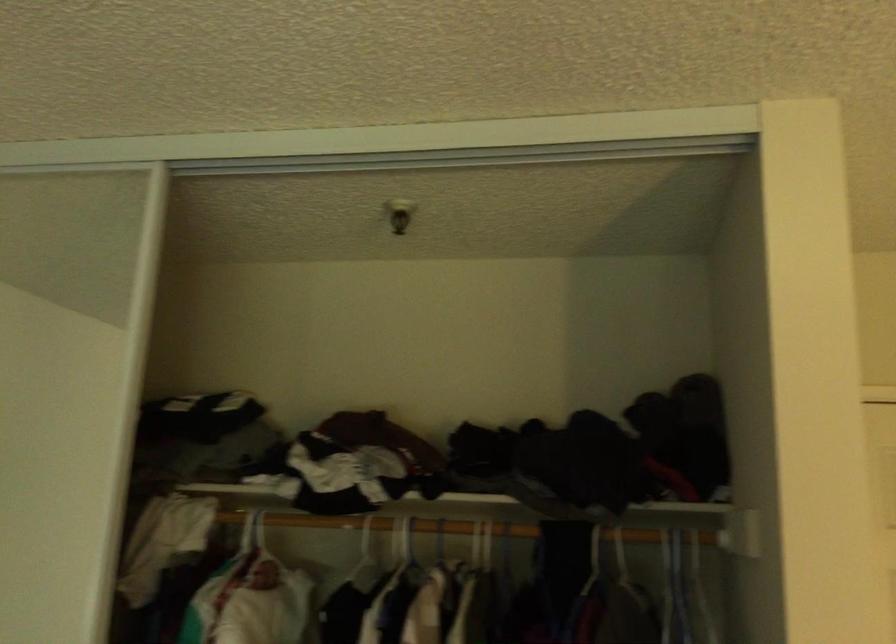
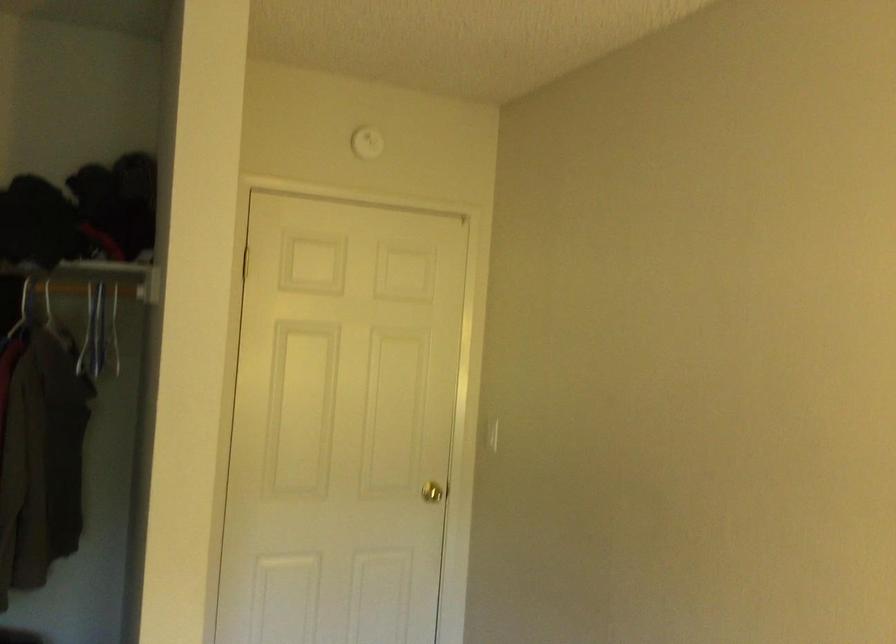
Question: Based on the continuous images, in which direction is the camera rotating? Reply with the corresponding letter.

Choices:
 (A) Left
 (B) Right
 (C) Up
 (D) Down

Answer: (B)